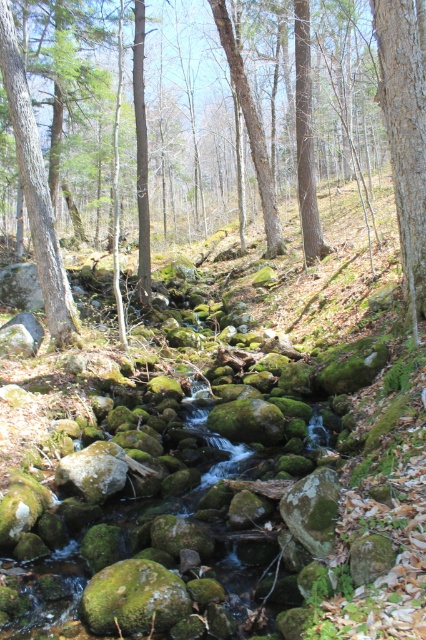
Question: Which point is closer to the camera taking this photo?

Choices:
 (A) pyautogui.click(x=31, y=129)
 (B) pyautogui.click(x=146, y=168)

Answer: (A)

Question: Does green mossy rock at center have a larger size compared to smooth bark tree at right?

Choices:
 (A) no
 (B) yes

Answer: (B)

Question: Among these points, which one is nearest to the camera?

Choices:
 (A) (423, 262)
 (B) (409, 4)

Answer: (B)

Question: Where is green mossy rock at center located in relation to smooth bark tree at right in the image?

Choices:
 (A) left
 (B) right

Answer: (A)

Question: Does green mossy rock at center have a smaller size compared to smooth bark tree at right?

Choices:
 (A) yes
 (B) no

Answer: (B)

Question: Which object is the closest to the smooth bark tree at right?

Choices:
 (A) green mossy rock at center
 (B) green textured tree trunk at left

Answer: (B)